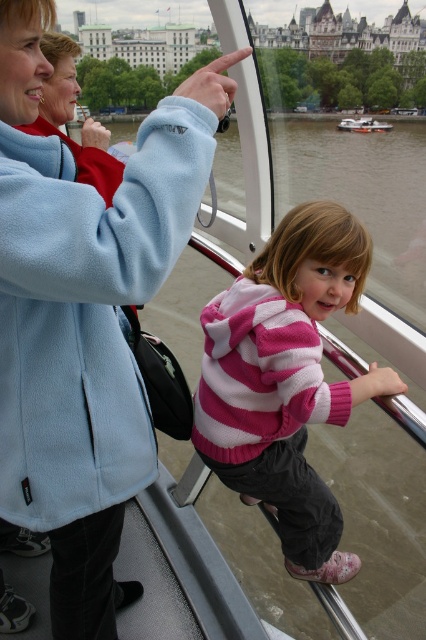
Question: Is brown water at center above white plastic boat at center?

Choices:
 (A) yes
 (B) no

Answer: (B)

Question: Which point is closer to the camera?

Choices:
 (A) pink striped sweater at center
 (B) brown water at center
 (C) white plastic boat at center

Answer: (A)

Question: Is light blue fleece jacket at upper left to the left of white plastic boat at center from the viewer's perspective?

Choices:
 (A) yes
 (B) no

Answer: (A)

Question: Which point appears farthest from the camera in this image?

Choices:
 (A) (357, 163)
 (B) (2, 326)
 (C) (385, 122)
 (D) (333, 289)

Answer: (C)

Question: Estimate the real-world distances between objects in this image. Which object is closer to the light blue fleece jacket at upper left?

Choices:
 (A) pink striped sweater at center
 (B) brown water at center

Answer: (A)

Question: Can you confirm if light blue fleece jacket at upper left is bigger than brown water at center?

Choices:
 (A) no
 (B) yes

Answer: (A)